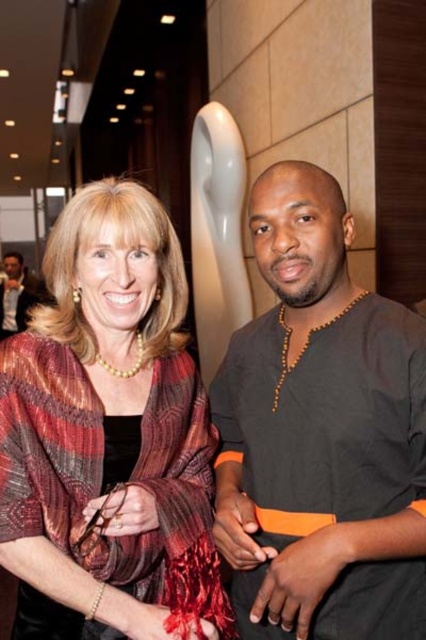
You are organizing a clothing donation drive and need to sort shirts by size. You have two shirts in front of you labeled as black matte shirt at right and matte black shirt at left. Which shirt should you place in the larger size bin?

The matte black shirt at left should be placed in the larger size bin because the black matte shirt at right is smaller than it.

Consider the image. You are a photographer at a formal event. You need to take a photo of the two people standing at point (114, 234). The minimum distance required for your camera to focus properly is 4 feet. Will the camera be able to focus on both people?

The two people are 3.98 feet apart, which is less than the 4 feet minimum distance required for the camera to focus properly. Therefore, the camera may struggle to focus on both individuals simultaneously.

What is located at the coordinates point (109,436) in the image?

The point (109,436) indicates the location of the matte red scarf at center.